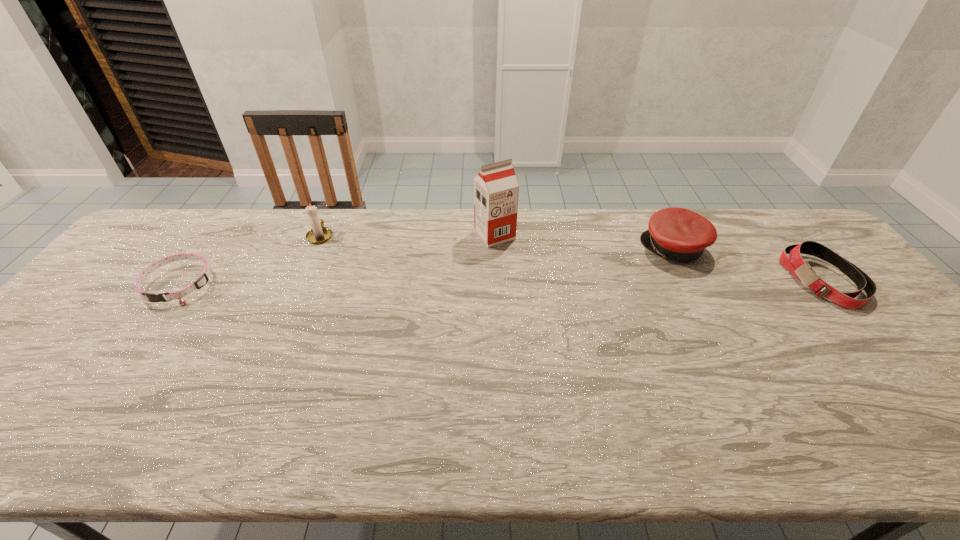
Find the location of a particular element. The width and height of the screenshot is (960, 540). free space between the soya milk and the shorter dog collar is located at coordinates (337, 260).

Image resolution: width=960 pixels, height=540 pixels. Find the location of `vacant space in between the cap and the taller dog collar`. vacant space in between the cap and the taller dog collar is located at coordinates (749, 265).

Where is `free space between the third object from left to right and the fourth shortest object`? This screenshot has width=960, height=540. free space between the third object from left to right and the fourth shortest object is located at coordinates (408, 235).

This screenshot has height=540, width=960. In order to click on free spot between the right dog collar and the second tallest object in this screenshot , I will do `click(572, 258)`.

This screenshot has height=540, width=960. Find the location of `blank region between the candle holder and the left dog collar`. blank region between the candle holder and the left dog collar is located at coordinates (250, 260).

Locate an element on the screen. The width and height of the screenshot is (960, 540). free space between the third shortest object and the rightmost object is located at coordinates (749, 265).

Where is `free space between the taller dog collar and the second tallest object`? This screenshot has height=540, width=960. free space between the taller dog collar and the second tallest object is located at coordinates (572, 258).

You are a GUI agent. You are given a task and a screenshot of the screen. Output one action in this format:
    pyautogui.click(x=<x>, y=<y>)
    Task: Click on the free space between the leftmost object and the tallest object
    The height and width of the screenshot is (540, 960).
    Given the screenshot: What is the action you would take?
    pyautogui.click(x=337, y=260)

Locate an element on the screen. the third closest object to the shortest object is located at coordinates (679, 234).

Point out which object is positioned as the second nearest to the fourth shortest object. Please provide its 2D coordinates. Your answer should be formatted as a tuple, i.e. [(x, y)], where the tuple contains the x and y coordinates of a point satisfying the conditions above.

[(496, 190)]